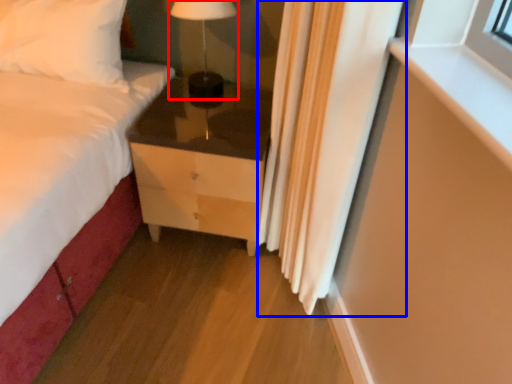
Question: Which of the following is the closest to the observer, table lamp (highlighted by a red box) or curtain (highlighted by a blue box)?

Choices:
 (A) table lamp
 (B) curtain

Answer: (B)